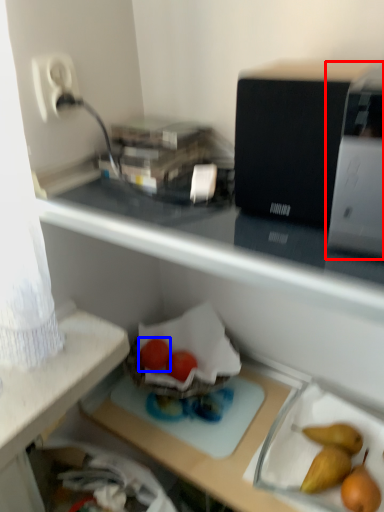
Question: Which object appears farthest to the camera in this image, appliance (highlighted by a red box) or green vegetables (highlighted by a blue box)?

Choices:
 (A) appliance
 (B) green vegetables

Answer: (B)